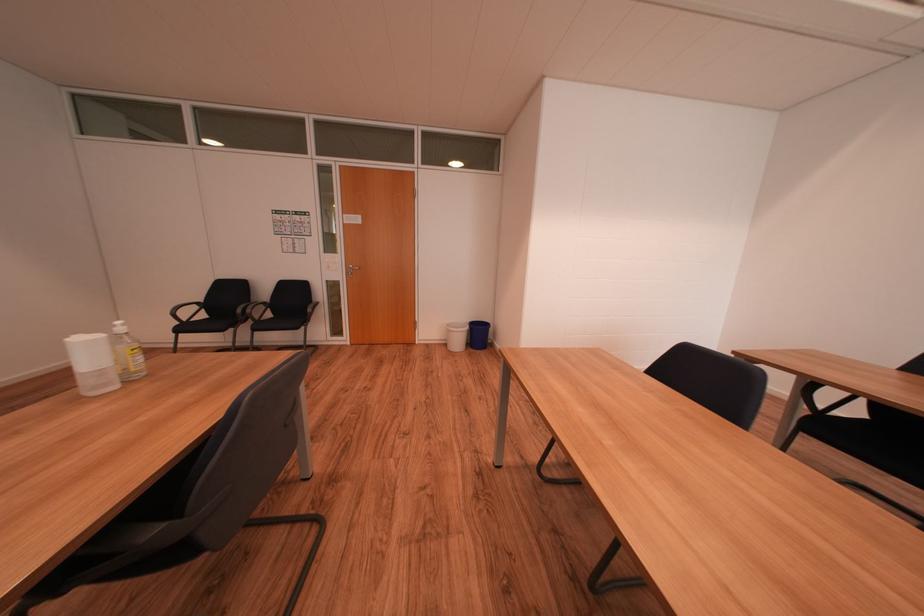
Locate an element on the screen. silver door handle is located at coordinates point(351,269).